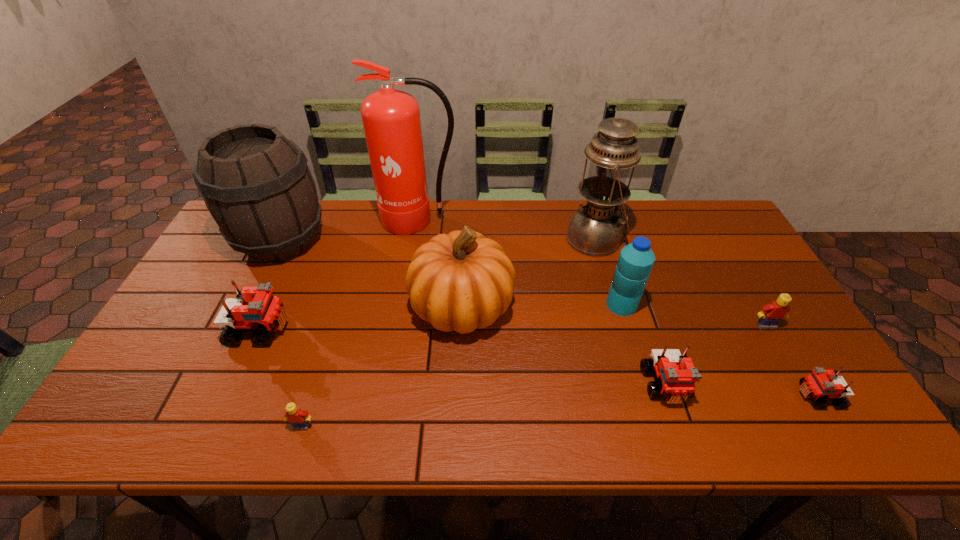
Where is `vacant space in between the red fire extinguisher and the farthest red Lego`? The image size is (960, 540). vacant space in between the red fire extinguisher and the farthest red Lego is located at coordinates (340, 275).

At what (x,y) coordinates should I click in order to perform the action: click on empty location between the wine bucket and the right yellow Lego. Please return your answer as a coordinate pair (x, y). The width and height of the screenshot is (960, 540). Looking at the image, I should click on (523, 283).

You are a GUI agent. You are given a task and a screenshot of the screen. Output one action in this format:
    pyautogui.click(x=<x>, y=<y>)
    Task: Click on the free space between the pumpkin and the right yellow Lego
    The image size is (960, 540).
    Given the screenshot: What is the action you would take?
    [x=614, y=316]

This screenshot has width=960, height=540. I want to click on unoccupied position between the fire extinguisher and the water bottle, so click(520, 262).

At what (x,y) coordinates should I click in order to perform the action: click on vacant point located between the rightmost red Lego and the farther yellow Lego. Please return your answer as a coordinate pair (x, y). Image resolution: width=960 pixels, height=540 pixels. Looking at the image, I should click on (792, 361).

Locate which object ranks fifth in proximity to the third Lego from right to left. Please provide its 2D coordinates. Your answer should be formatted as a tuple, i.e. [(x, y)], where the tuple contains the x and y coordinates of a point satisfying the conditions above.

[(595, 229)]

Locate an element on the screen. object that is the fifth closest to the blue water bottle is located at coordinates (822, 384).

The width and height of the screenshot is (960, 540). Identify the location of Lego that is the fourth closest to the leftmost red Lego. (822, 384).

Identify which Lego is located as the nearest to the right yellow Lego. Please provide its 2D coordinates. Your answer should be formatted as a tuple, i.e. [(x, y)], where the tuple contains the x and y coordinates of a point satisfying the conditions above.

[(822, 384)]

Identify which red Lego is located as the second nearest to the red fire extinguisher. Please provide its 2D coordinates. Your answer should be formatted as a tuple, i.e. [(x, y)], where the tuple contains the x and y coordinates of a point satisfying the conditions above.

[(677, 374)]